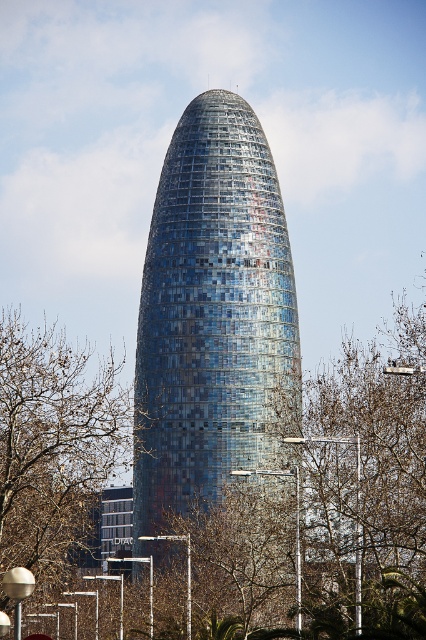
Who is taller, blue glassy tower at center or brown leafless tree at left?

A: With more height is blue glassy tower at center.

Is blue glassy tower at center taller than brown leafless tree at left?

Yes, blue glassy tower at center is taller than brown leafless tree at left.

Where is `blue glassy tower at center`? This screenshot has height=640, width=426. blue glassy tower at center is located at coordinates (213, 316).